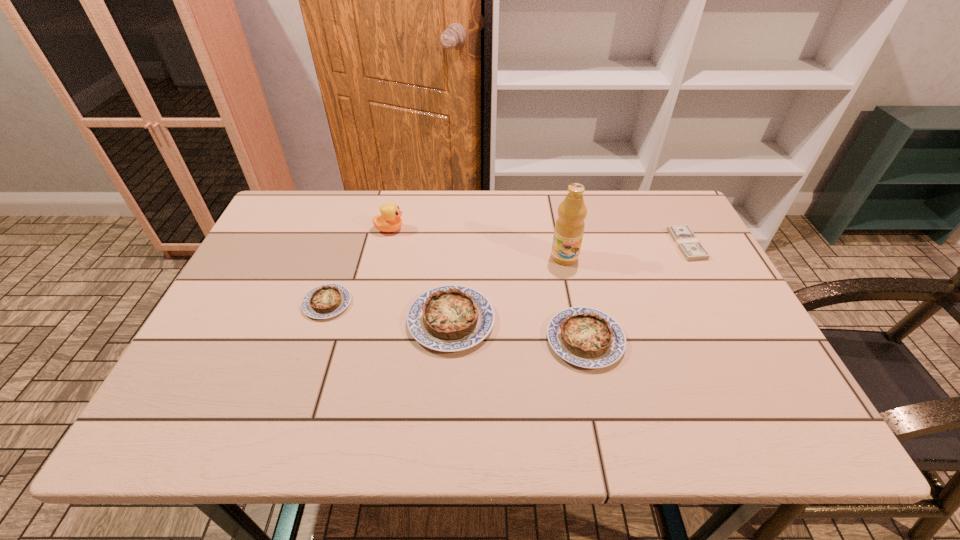
In the current image, all quiches are evenly spaced. To maintain this equal spacing, where should an additional quiche be placed on the right? Please point out a free spot. Please provide its 2D coordinates. Your answer should be formatted as a tuple, i.e. [(x, y)], where the tuple contains the x and y coordinates of a point satisfying the conditions above.

[(731, 360)]